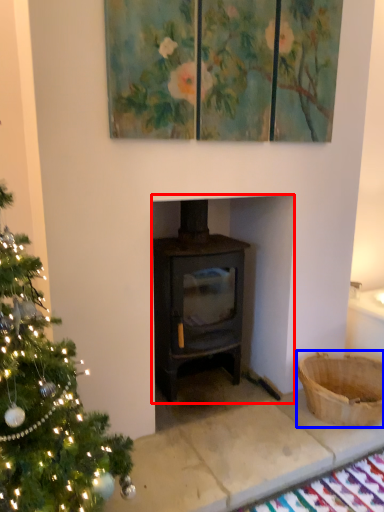
Question: Which point is closer to the camera, fireplace (highlighted by a red box) or basket (highlighted by a blue box)?

Choices:
 (A) fireplace
 (B) basket

Answer: (A)